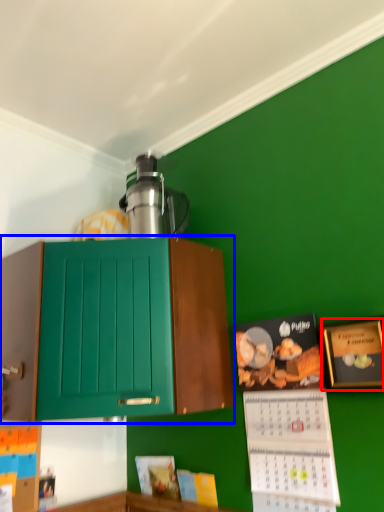
Question: Which of the following is the farthest to the observer, picture frame (highlighted by a red box) or cabinetry (highlighted by a blue box)?

Choices:
 (A) picture frame
 (B) cabinetry

Answer: (A)